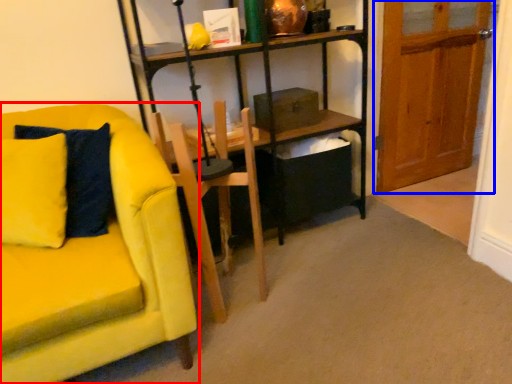
Question: Which object is further to the camera taking this photo, chair (highlighted by a red box) or door (highlighted by a blue box)?

Choices:
 (A) chair
 (B) door

Answer: (B)